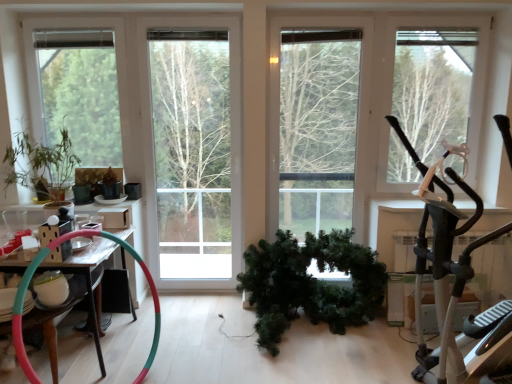
Question: Considering the relative sizes of green matte plant at left, which is the 1th houseplant from top to bottom, and green matte tree at center, the 2th tree in the left-to-right sequence, in the image provided, is green matte plant at left, which is the 1th houseplant from top to bottom, wider than green matte tree at center, the 2th tree in the left-to-right sequence,?

Choices:
 (A) yes
 (B) no

Answer: (A)

Question: Is green matte plant at left, the first houseplant from the left, smaller than green matte tree at center, the 2th tree in the left-to-right sequence?

Choices:
 (A) yes
 (B) no

Answer: (A)

Question: Is green matte plant at left, the second houseplant ordered from the bottom, thinner than green matte tree at center, which is the 2th tree from right to left?

Choices:
 (A) yes
 (B) no

Answer: (B)

Question: From a real-world perspective, is green matte plant at left, the second houseplant ordered from the bottom, located beneath green matte tree at center, the 2th tree in the left-to-right sequence?

Choices:
 (A) yes
 (B) no

Answer: (A)

Question: Does green matte plant at left, the first houseplant from the left, appear on the right side of green matte tree at center, the 2th tree in the left-to-right sequence?

Choices:
 (A) no
 (B) yes

Answer: (A)

Question: Considering the positions of green matte wreath at center, which appears as the 1th houseplant when ordered from the bottom, and green matte tree at center, which is the 2th tree from right to left, in the image, is green matte wreath at center, which appears as the 1th houseplant when ordered from the bottom, taller or shorter than green matte tree at center, which is the 2th tree from right to left,?

Choices:
 (A) short
 (B) tall

Answer: (A)

Question: Is green matte wreath at center, which appears as the 1th houseplant when ordered from the bottom, inside or outside of green matte tree at center, the 2th tree in the left-to-right sequence?

Choices:
 (A) inside
 (B) outside

Answer: (B)

Question: From a real-world perspective, is green matte wreath at center, which is counted as the 2th houseplant, starting from the left, above or below green matte tree at center, which is the 2th tree from right to left?

Choices:
 (A) below
 (B) above

Answer: (A)

Question: Considering the positions of green matte wreath at center, the 1th houseplant in the right-to-left sequence, and green matte tree at center, which is the 2th tree from right to left, in the image, is green matte wreath at center, the 1th houseplant in the right-to-left sequence, wider or thinner than green matte tree at center, which is the 2th tree from right to left,?

Choices:
 (A) thin
 (B) wide

Answer: (B)

Question: Considering the positions of wooden table at left and green matte wreath at center, which is counted as the 2th houseplant, starting from the left, in the image, is wooden table at left taller or shorter than green matte wreath at center, which is counted as the 2th houseplant, starting from the left,?

Choices:
 (A) tall
 (B) short

Answer: (A)

Question: Based on their positions, is wooden table at left located to the left or right of green matte wreath at center, which appears as the 1th houseplant when ordered from the bottom?

Choices:
 (A) left
 (B) right

Answer: (A)

Question: Looking at their shapes, would you say wooden table at left is wider or thinner than green matte wreath at center, the 1th houseplant in the right-to-left sequence?

Choices:
 (A) thin
 (B) wide

Answer: (A)

Question: Does point (88, 266) appear closer or farther from the camera than point (258, 302)?

Choices:
 (A) farther
 (B) closer

Answer: (B)

Question: From a real-world perspective, relative to green matte tree at center, which is the 2th tree from right to left, is wooden table at left vertically above or below?

Choices:
 (A) above
 (B) below

Answer: (B)

Question: In the image, is wooden table at left positioned in front of or behind green matte tree at center, the 2th tree in the left-to-right sequence?

Choices:
 (A) behind
 (B) front

Answer: (B)